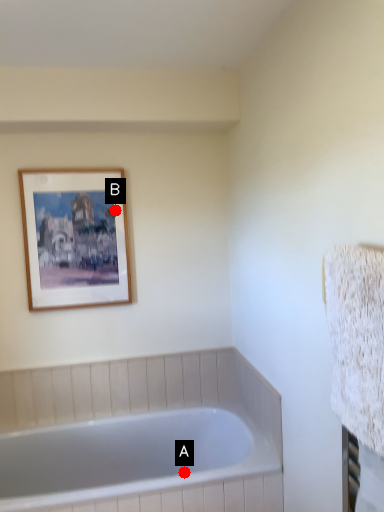
Question: Two points are circled on the image, labeled by A and B beside each circle. Among these points, which one is farthest from the camera?

Choices:
 (A) A is further
 (B) B is further

Answer: (A)